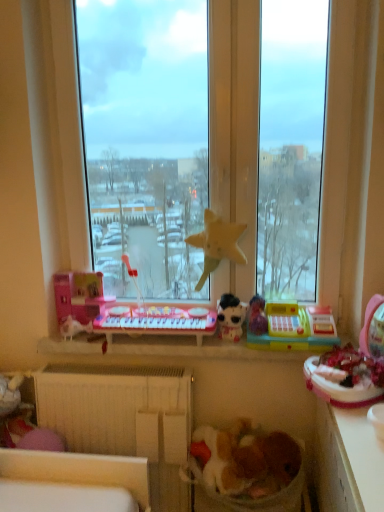
Question: Is white glossy counter top at lower right wider or thinner than transparent glass window at center?

Choices:
 (A) thin
 (B) wide

Answer: (B)

Question: From a real-world perspective, relative to transparent glass window at center, is white glossy counter top at lower right vertically above or below?

Choices:
 (A) above
 (B) below

Answer: (B)

Question: Which object is the farthest from the transparent glass window at center?

Choices:
 (A) white glossy counter top at lower right
 (B) white plush toy at lower left
 (C) yellow fabric star at center, acting as the second toy starting from the left
 (D) fluffy fabric laundry basket at lower center
 (E) white plastic toys at center

Answer: (B)

Question: Which is nearer to the fluffy fabric laundry basket at lower center?

Choices:
 (A) transparent glass window at center
 (B) white matte plush toy at center, which ranks as the second toy in right-to-left order
 (C) yellow fabric star at center, acting as the second toy starting from the left
 (D) white plastic toys at center
 (E) white glossy counter top at lower right

Answer: (E)